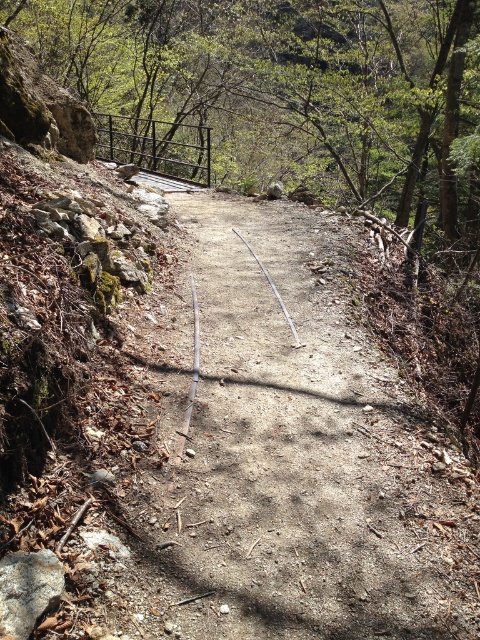
What do you see at coordinates (292, 92) in the screenshot? The height and width of the screenshot is (640, 480). I see `green leafy tree at center` at bounding box center [292, 92].

Who is lower down, green leafy tree at center or gray rough rock at lower left?

gray rough rock at lower left

Does point (241, 100) come behind point (35, 580)?

Yes, point (241, 100) is farther from viewer.

This screenshot has width=480, height=640. Identify the location of green leafy tree at center. (292, 92).

Does dirt path at center appear over green leafy tree at center?

No.

Is dirt path at center in front of green leafy tree at center?

Yes, dirt path at center is closer to the viewer.

Does point (280, 440) come in front of point (386, 211)?

Yes.

The width and height of the screenshot is (480, 640). Identify the location of dirt path at center. (300, 458).

Who is lower down, dirt path at center or gray rough rock at lower left?

gray rough rock at lower left is lower down.

What do you see at coordinates (300, 458) in the screenshot? The width and height of the screenshot is (480, 640). I see `dirt path at center` at bounding box center [300, 458].

Where is `dirt path at center`? Image resolution: width=480 pixels, height=640 pixels. dirt path at center is located at coordinates (300, 458).